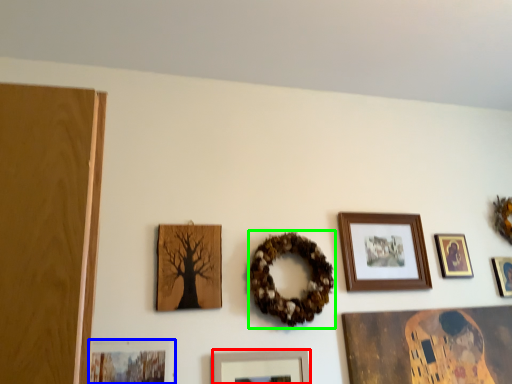
Question: Which object is the farthest from picture frame (highlighted by a red box)? Choose among these: picture frame (highlighted by a blue box) or decor (highlighted by a green box).

Choices:
 (A) picture frame
 (B) decor

Answer: (A)